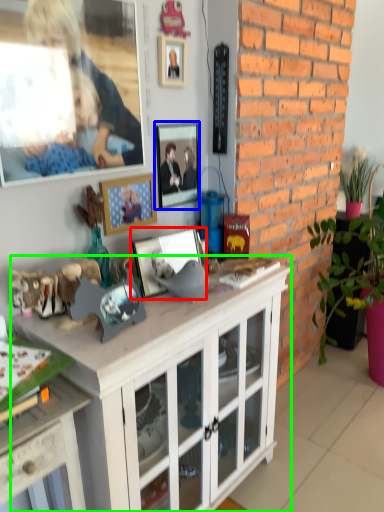
Question: Estimate the real-world distances between objects in this image. Which object is farther from picture frame (highlighted by a red box), picture frame (highlighted by a blue box) or cabinetry (highlighted by a green box)?

Choices:
 (A) picture frame
 (B) cabinetry

Answer: (B)